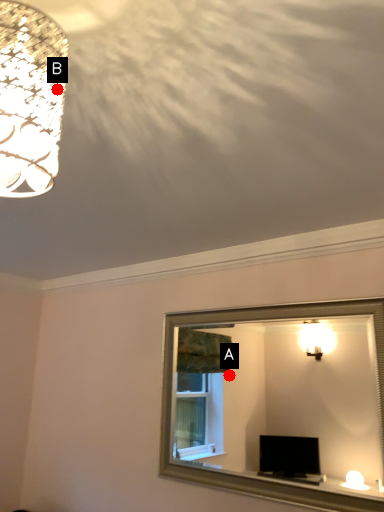
Question: Two points are circled on the image, labeled by A and B beside each circle. Which point is closer to the camera?

Choices:
 (A) A is closer
 (B) B is closer

Answer: (B)